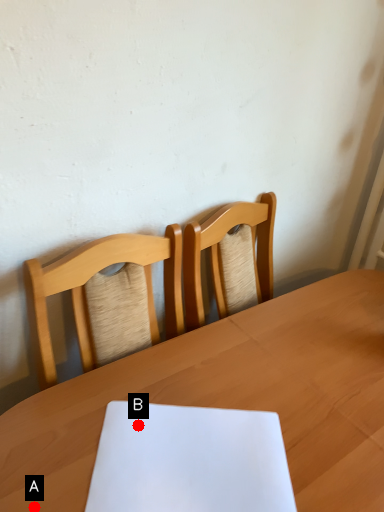
Question: Two points are circled on the image, labeled by A and B beside each circle. Which of the following is the farthest from the observer?

Choices:
 (A) A is further
 (B) B is further

Answer: (B)